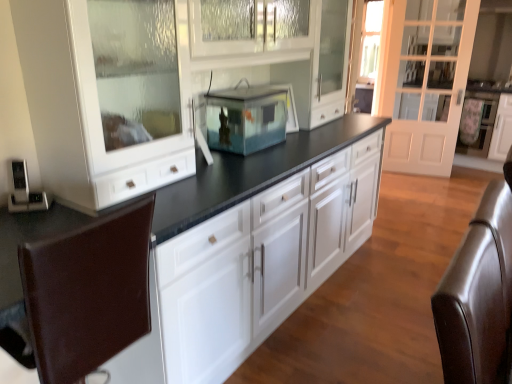
The image size is (512, 384). I want to click on vacant point to the right of matte black speaker at left, the 2th appliance positioned from the top, so click(x=60, y=216).